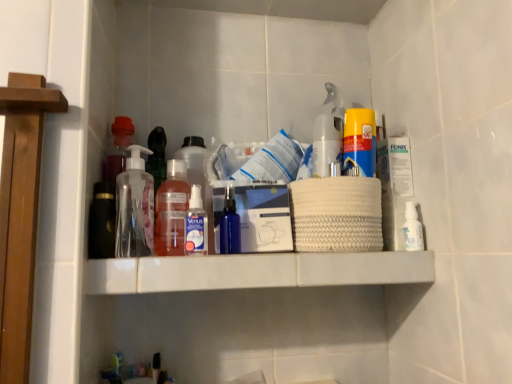
Question: Is transparent plastic pump bottle at center, placed as the 6th bottle when sorted from right to left, oriented towards translucent plastic bottle at center, the 5th bottle in the right-to-left sequence?

Choices:
 (A) no
 (B) yes

Answer: (A)

Question: Is transparent plastic pump bottle at center, which is the first bottle in left-to-right order, located outside translucent plastic bottle at center, marked as the second bottle in a left-to-right arrangement?

Choices:
 (A) yes
 (B) no

Answer: (A)

Question: Is transparent plastic pump bottle at center, which is the first bottle in left-to-right order, in contact with translucent plastic bottle at center, the 5th bottle in the right-to-left sequence?

Choices:
 (A) no
 (B) yes

Answer: (B)

Question: Does transparent plastic pump bottle at center, placed as the 6th bottle when sorted from right to left, have a greater height compared to translucent plastic bottle at center, the 5th bottle in the right-to-left sequence?

Choices:
 (A) yes
 (B) no

Answer: (A)

Question: Does transparent plastic pump bottle at center, placed as the 6th bottle when sorted from right to left, have a lesser height compared to translucent plastic bottle at center, the 5th bottle in the right-to-left sequence?

Choices:
 (A) no
 (B) yes

Answer: (A)

Question: From a real-world perspective, is transparent plastic pump bottle at center, placed as the 6th bottle when sorted from right to left, positioned over translucent plastic bottle at center, marked as the second bottle in a left-to-right arrangement, based on gravity?

Choices:
 (A) yes
 (B) no

Answer: (A)

Question: Considering the relative positions of translucent plastic bottle at center, placed as the fourth bottle when sorted from right to left, and yellow matte canister at upper center in the image provided, is translucent plastic bottle at center, placed as the fourth bottle when sorted from right to left, behind yellow matte canister at upper center?

Choices:
 (A) no
 (B) yes

Answer: (B)

Question: From a real-world perspective, is translucent plastic bottle at center, placed as the fourth bottle when sorted from right to left, on yellow matte canister at upper center?

Choices:
 (A) yes
 (B) no

Answer: (B)

Question: Considering the relative sizes of translucent plastic bottle at center, placed as the fourth bottle when sorted from right to left, and yellow matte canister at upper center in the image provided, is translucent plastic bottle at center, placed as the fourth bottle when sorted from right to left, shorter than yellow matte canister at upper center?

Choices:
 (A) no
 (B) yes

Answer: (A)

Question: Is translucent plastic bottle at center, which ranks as the 3th bottle in left-to-right order, positioned far away from yellow matte canister at upper center?

Choices:
 (A) no
 (B) yes

Answer: (A)

Question: Is translucent plastic bottle at center, placed as the fourth bottle when sorted from right to left, touching yellow matte canister at upper center?

Choices:
 (A) yes
 (B) no

Answer: (B)

Question: Considering the relative sizes of translucent plastic bottle at center, which ranks as the 3th bottle in left-to-right order, and yellow matte canister at upper center in the image provided, is translucent plastic bottle at center, which ranks as the 3th bottle in left-to-right order, thinner than yellow matte canister at upper center?

Choices:
 (A) yes
 (B) no

Answer: (B)

Question: From a real-world perspective, is transparent plastic pump bottle at center, which is the first bottle in left-to-right order, beneath translucent plastic bottle at center, placed as the fourth bottle when sorted from right to left?

Choices:
 (A) yes
 (B) no

Answer: (A)